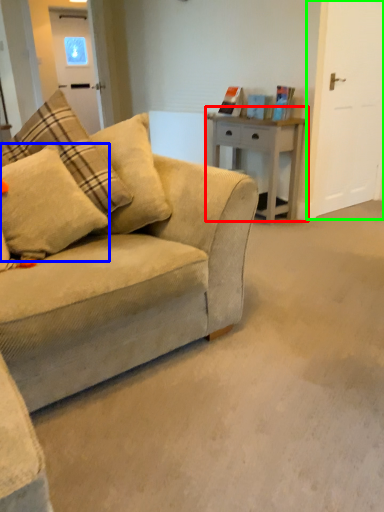
Question: Which object is the closest to the table (highlighted by a red box)? Choose among these: pillow (highlighted by a blue box) or glass door (highlighted by a green box).

Choices:
 (A) pillow
 (B) glass door

Answer: (B)